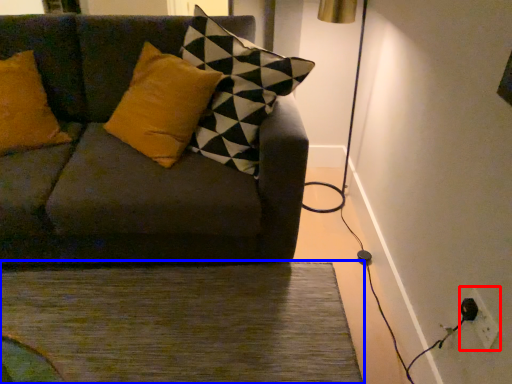
Question: Which object is closer to the camera taking this photo, electric outlet (highlighted by a red box) or doormat (highlighted by a blue box)?

Choices:
 (A) electric outlet
 (B) doormat

Answer: (A)